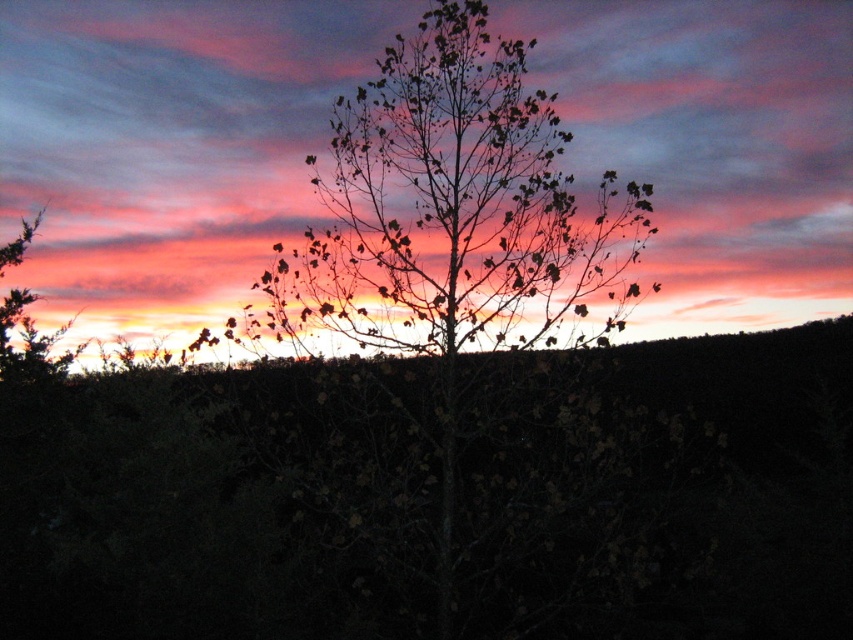
Between pink matte cloud at upper center and silhouette tree at center, which one appears on the right side from the viewer's perspective?

Positioned to the right is silhouette tree at center.

Between point (624, 22) and point (277, 300), which one is positioned behind?

The point (624, 22) is behind.

Find the location of `pink matte cloud at upper center`. pink matte cloud at upper center is located at coordinates (169, 145).